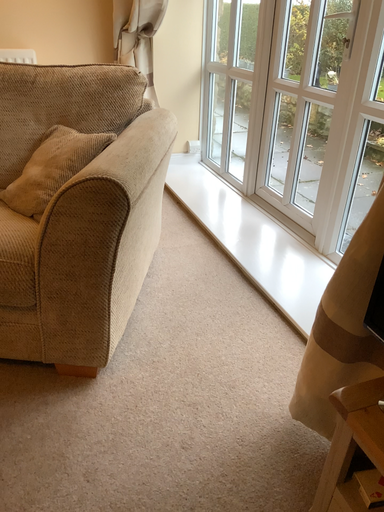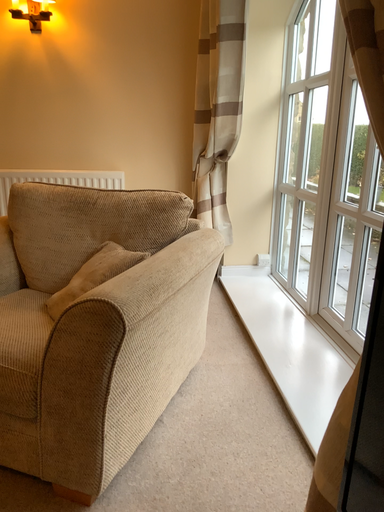
Question: Which way did the camera rotate in the video?

Choices:
 (A) rotated left
 (B) rotated right

Answer: (A)